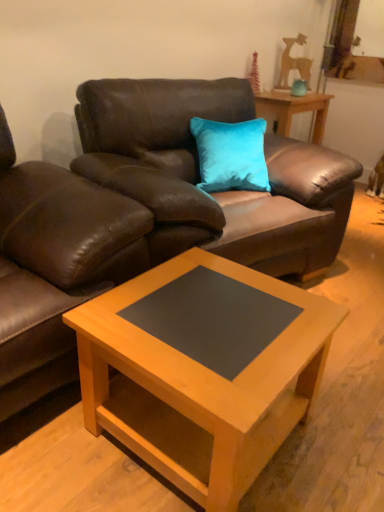
Question: Is brown leather couch at upper center spatially inside light wood/black laminate coffee table at center, or outside of it?

Choices:
 (A) outside
 (B) inside

Answer: (A)

Question: In the image, is brown leather couch at upper center positioned in front of or behind light wood/black laminate coffee table at center?

Choices:
 (A) behind
 (B) front

Answer: (A)

Question: Which of these objects is positioned farthest from the teal velvet vase at upper right?

Choices:
 (A) wooden table at center
 (B) brown leather swivel chair at left
 (C) light wood/black laminate coffee table at center
 (D) brown leather couch at upper center

Answer: (C)

Question: Based on their relative distances, which object is nearer to the brown leather swivel chair at left?

Choices:
 (A) brown leather couch at upper center
 (B) light wood/black laminate coffee table at center
 (C) teal velvet vase at upper right
 (D) wooden table at center

Answer: (A)